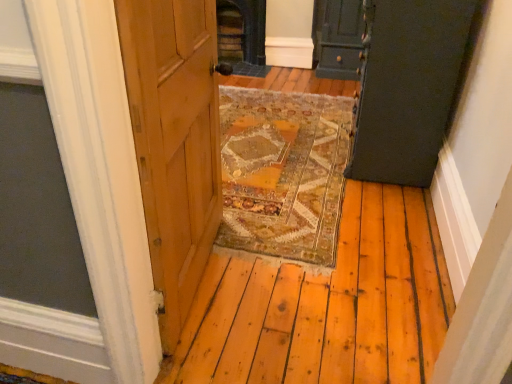
Question: Considering the relative sizes of matte dark green cabinet at upper right, marked as the second door in a back-to-front arrangement, and dark green wood door at upper right, the 1th door when ordered from back to front, in the image provided, is matte dark green cabinet at upper right, marked as the second door in a back-to-front arrangement, smaller than dark green wood door at upper right, the 1th door when ordered from back to front,?

Choices:
 (A) yes
 (B) no

Answer: (B)

Question: Is matte dark green cabinet at upper right, acting as the 1th door starting from the front, oriented away from dark green wood door at upper right, acting as the second door starting from the front?

Choices:
 (A) no
 (B) yes

Answer: (A)

Question: Is the position of matte dark green cabinet at upper right, acting as the 1th door starting from the front, less distant than that of dark green wood door at upper right, acting as the second door starting from the front?

Choices:
 (A) no
 (B) yes

Answer: (B)

Question: Is matte dark green cabinet at upper right, acting as the 1th door starting from the front, in contact with dark green wood door at upper right, acting as the second door starting from the front?

Choices:
 (A) yes
 (B) no

Answer: (B)

Question: Could you tell me if matte dark green cabinet at upper right, marked as the second door in a back-to-front arrangement, is facing dark green wood door at upper right, acting as the second door starting from the front?

Choices:
 (A) no
 (B) yes

Answer: (A)

Question: Considering the relative positions of matte dark green cabinet at upper right, acting as the 1th door starting from the front, and dark green wood door at upper right, acting as the second door starting from the front, in the image provided, is matte dark green cabinet at upper right, acting as the 1th door starting from the front, behind dark green wood door at upper right, acting as the second door starting from the front,?

Choices:
 (A) no
 (B) yes

Answer: (A)

Question: From the image's perspective, is dark gray stone fireplace at center above dark green wood door at upper right, the 1th door when ordered from back to front?

Choices:
 (A) no
 (B) yes

Answer: (B)

Question: Does dark gray stone fireplace at center turn towards dark green wood door at upper right, acting as the second door starting from the front?

Choices:
 (A) no
 (B) yes

Answer: (A)

Question: Can we say dark gray stone fireplace at center lies outside dark green wood door at upper right, acting as the second door starting from the front?

Choices:
 (A) yes
 (B) no

Answer: (A)

Question: Is dark gray stone fireplace at center behind dark green wood door at upper right, the 1th door when ordered from back to front?

Choices:
 (A) yes
 (B) no

Answer: (A)

Question: From a real-world perspective, is dark gray stone fireplace at center physically above dark green wood door at upper right, the 1th door when ordered from back to front?

Choices:
 (A) yes
 (B) no

Answer: (B)

Question: Is dark gray stone fireplace at center shorter than dark green wood door at upper right, acting as the second door starting from the front?

Choices:
 (A) no
 (B) yes

Answer: (B)

Question: Can you confirm if dark green wood door at upper right, acting as the second door starting from the front, is bigger than matte dark green cabinet at upper right, marked as the second door in a back-to-front arrangement?

Choices:
 (A) no
 (B) yes

Answer: (A)